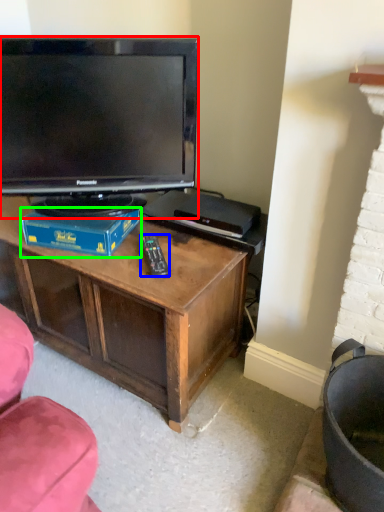
Question: Considering the real-world distances, which object is closest to television (highlighted by a red box)? remote (highlighted by a blue box) or book (highlighted by a green box).

Choices:
 (A) remote
 (B) book

Answer: (B)